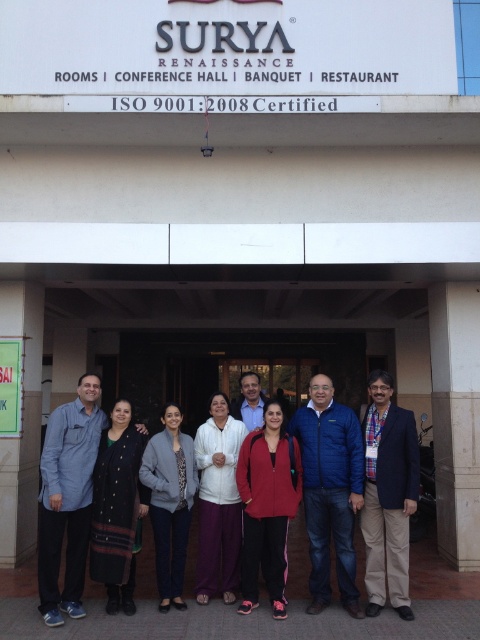
Question: Is blue fleece jacket at center further to the viewer compared to dark blue denim shirt at center?

Choices:
 (A) no
 (B) yes

Answer: (B)

Question: Which is farther from the matte red jacket at center?

Choices:
 (A) matte gray jacket at center
 (B) blue fleece jacket at center
 (C) green paper at left
 (D) black woolen shawl at center

Answer: (C)

Question: Where is dark blue denim shirt at center located in relation to matte gray jacket at center in the image?

Choices:
 (A) right
 (B) left

Answer: (B)

Question: Which object is the farthest from the blue fleece jacket at center?

Choices:
 (A) black woolen shawl at center
 (B) white matte sweater at center
 (C) green paper at left

Answer: (C)

Question: Which point is closer to the camera?

Choices:
 (A) (206, 493)
 (B) (90, 390)

Answer: (B)

Question: From the image, what is the correct spatial relationship of black woolen shawl at center in relation to matte gray jacket at center?

Choices:
 (A) left
 (B) right

Answer: (A)